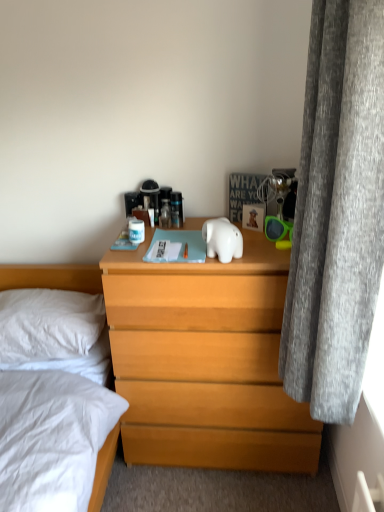
Question: Is the position of clear plastic bottle at center more distant than that of white glossy elephant at center?

Choices:
 (A) no
 (B) yes

Answer: (B)

Question: Is clear plastic bottle at center aimed at white glossy elephant at center?

Choices:
 (A) no
 (B) yes

Answer: (A)

Question: From a real-world perspective, is clear plastic bottle at center physically below white glossy elephant at center?

Choices:
 (A) no
 (B) yes

Answer: (B)

Question: Is clear plastic bottle at center to the right of white glossy elephant at center from the viewer's perspective?

Choices:
 (A) yes
 (B) no

Answer: (B)

Question: Is clear plastic bottle at center to the left of white glossy elephant at center from the viewer's perspective?

Choices:
 (A) no
 (B) yes

Answer: (B)

Question: Is white soft pillow at left taller or shorter than white glossy elephant at center?

Choices:
 (A) tall
 (B) short

Answer: (A)

Question: Considering the positions of point (62, 331) and point (230, 224), is point (62, 331) closer or farther from the camera than point (230, 224)?

Choices:
 (A) farther
 (B) closer

Answer: (B)

Question: Is white soft pillow at left in front of or behind white glossy elephant at center in the image?

Choices:
 (A) front
 (B) behind

Answer: (B)

Question: Would you say white soft pillow at left is to the left or to the right of white glossy elephant at center in the picture?

Choices:
 (A) left
 (B) right

Answer: (A)

Question: Based on their positions, is light brown wooden chest of drawers at center located to the left or right of gray fabric curtain at right?

Choices:
 (A) left
 (B) right

Answer: (A)

Question: From a real-world perspective, is light brown wooden chest of drawers at center physically located above or below gray fabric curtain at right?

Choices:
 (A) above
 (B) below

Answer: (B)

Question: From the image's perspective, is light brown wooden chest of drawers at center above or below gray fabric curtain at right?

Choices:
 (A) above
 (B) below

Answer: (B)

Question: Do you think light brown wooden chest of drawers at center is within gray fabric curtain at right, or outside of it?

Choices:
 (A) outside
 (B) inside

Answer: (A)

Question: Do you think white glossy elephant at center is within light brown wooden chest of drawers at center, or outside of it?

Choices:
 (A) outside
 (B) inside

Answer: (A)

Question: From the image's perspective, is white glossy elephant at center positioned above or below light brown wooden chest of drawers at center?

Choices:
 (A) below
 (B) above

Answer: (B)